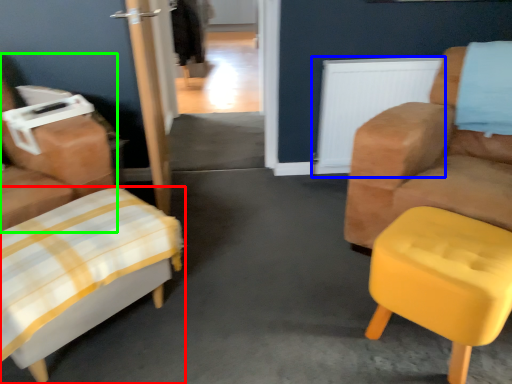
Question: Estimate the real-world distances between objects in this image. Which object is farther from furniture (highlighted by a red box), radiator (highlighted by a blue box) or chair (highlighted by a green box)?

Choices:
 (A) radiator
 (B) chair

Answer: (A)